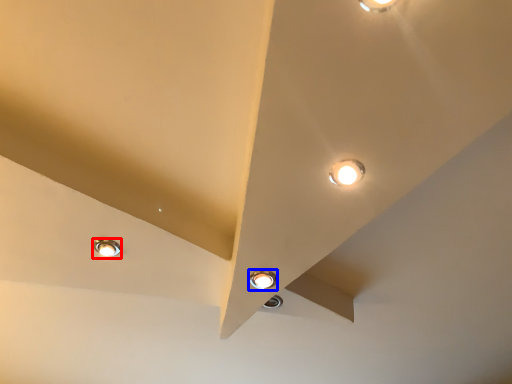
Question: Which of the following is the farthest to the observer, lamp (highlighted by a red box) or lamp (highlighted by a blue box)?

Choices:
 (A) lamp
 (B) lamp

Answer: (A)